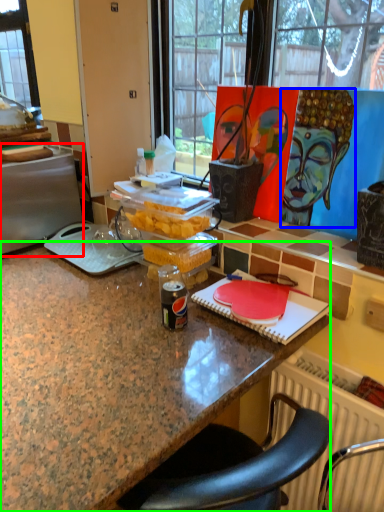
Question: Which object is the closest to the appliance (highlighted by a red box)? Choose among these: person (highlighted by a blue box) or desk (highlighted by a green box).

Choices:
 (A) person
 (B) desk

Answer: (B)